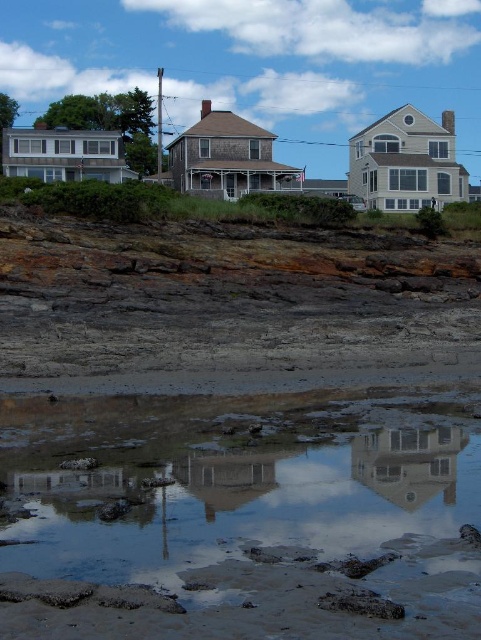
Between clear water at lower center and white glossy house at center, which one is positioned higher?

white glossy house at center is above.

Can you confirm if clear water at lower center is positioned above white glossy house at center?

No, clear water at lower center is not above white glossy house at center.

Between point (395, 547) and point (394, 497), which one is positioned in front?

Point (395, 547) is in front.

I want to click on clear water at lower center, so click(240, 524).